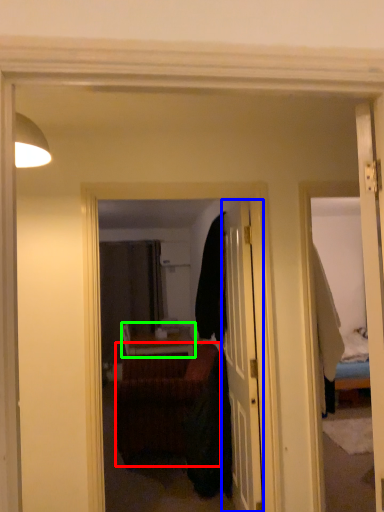
Question: Which object is positioned farthest from studio couch (highlighted by a red box)? Select from door (highlighted by a blue box) and table (highlighted by a green box).

Choices:
 (A) door
 (B) table

Answer: (B)